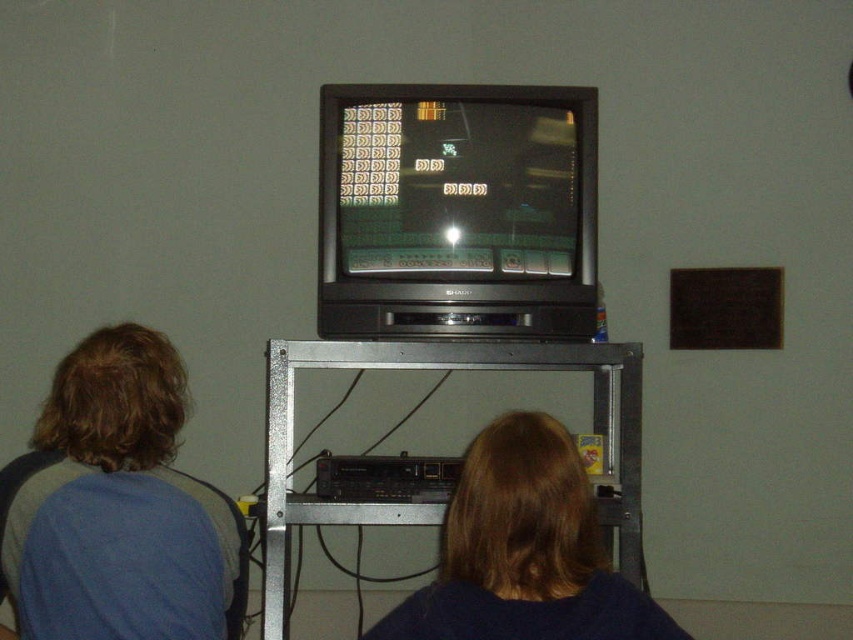
You are a furniture delivery person who needs to ensure that the black plastic tv at center can be placed on a shelf that is exactly the same height as the blue fabric shirt at left. Will the TV fit on the shelf?

The black plastic tv at center is taller than the blue fabric shirt at left, so it will not fit on the shelf that is the same height as the blue fabric shirt at left.

You are a fashion designer observing the scene. You need to determine which clothing item has a higher position in the image. Which one is taller between the blue fabric shirt at left and the dark blue sweater at lower center?

The blue fabric shirt at left is taller than the dark blue sweater at lower center.